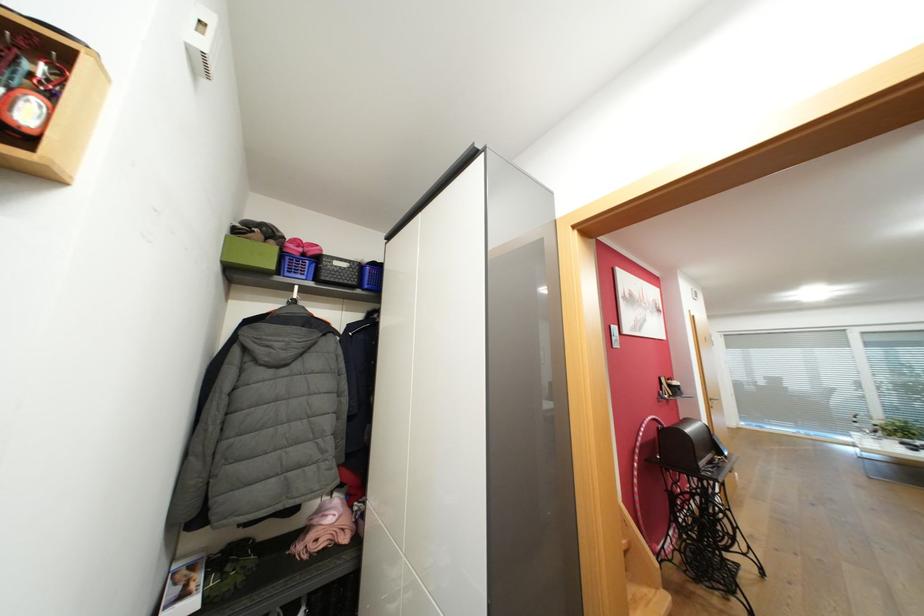
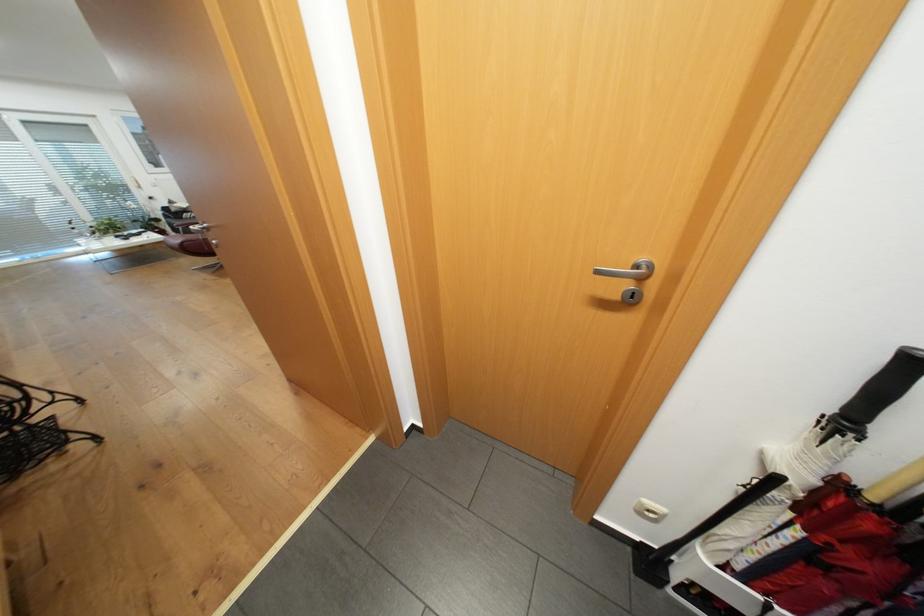
How did the camera likely rotate?

The camera's rotation is toward right-down.